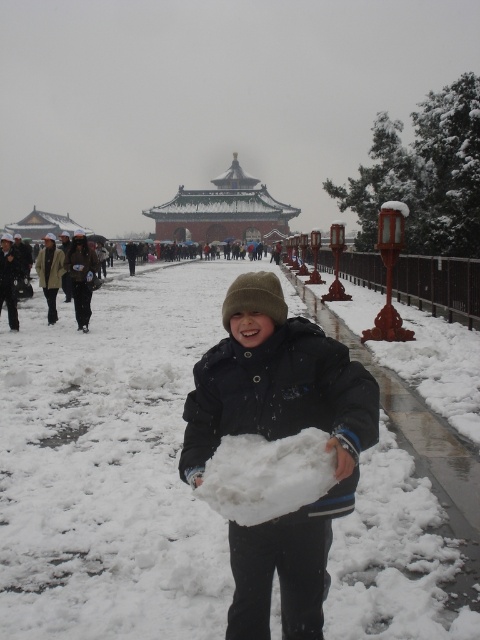
You are a photographer wanting to capture the golden dome of the building in the background and the white fluffy snow at center. Where should you position your camera to include both elements in the frame?

Position the camera so that it captures the golden dome in the background and the white fluffy snow at center at point (109, 467). This placement ensures both elements are visible in the frame.

You are a photographer trying to capture the snowball and the snow in the scene. Which object is closer to the camera, the white fluffy snow at center or the white fluffy snowball at center?

The white fluffy snow at center is closer to the camera because the white fluffy snowball at center is behind it.

You are a photographer wanting to capture the golden dome of the central building in the background while including both the white fluffy snow at center and the white fluffy snowball at center in the frame. Given their distance apart, will you need to adjust your camera settings to ensure both are in focus?

The white fluffy snow at center and white fluffy snowball at center are 7.47 meters apart. To ensure both are in focus, you would need to adjust your camera settings, such as using a smaller aperture or focusing at the hyperfocal distance, to increase depth of field.